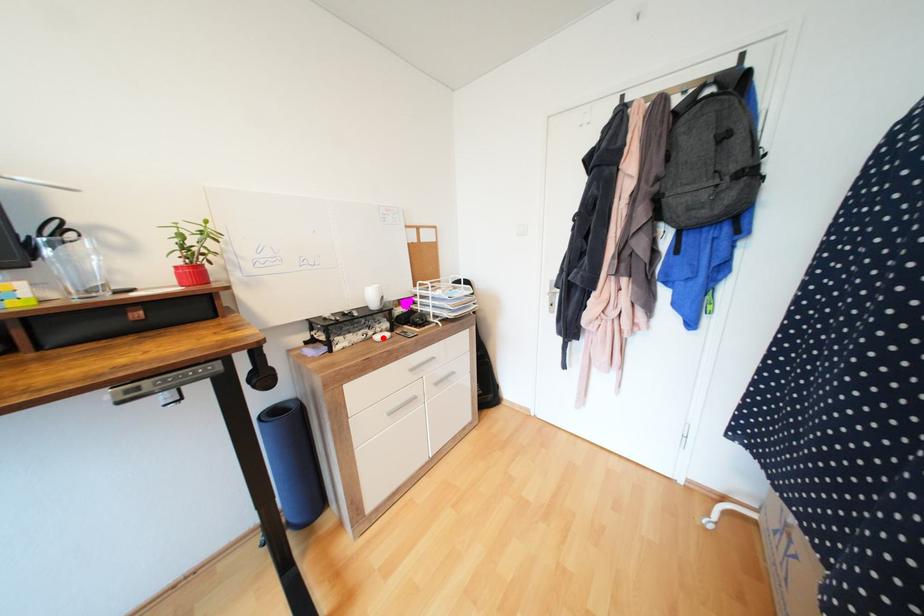
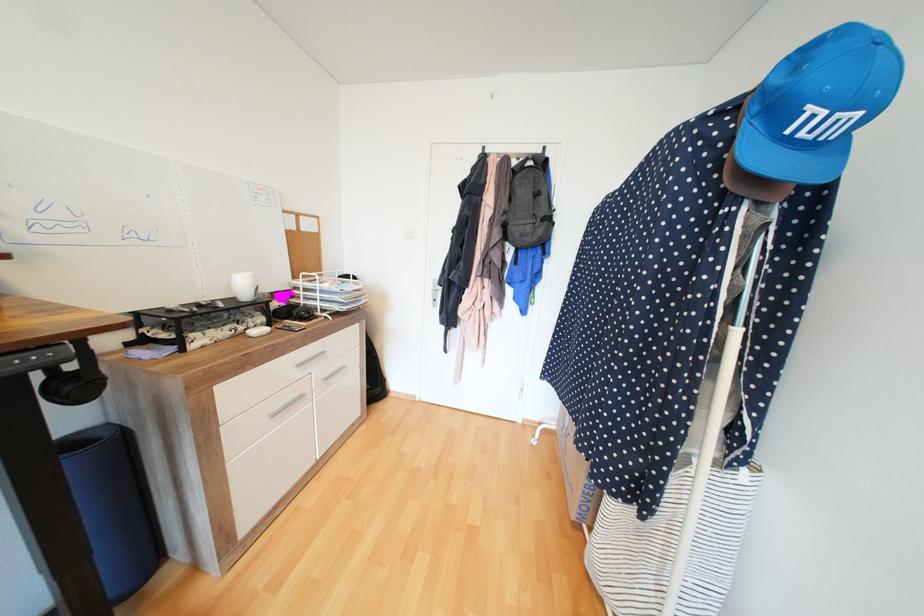
The point at the highlighted location is marked in the first image. Where is the corresponding point in the second image?

(260, 333)